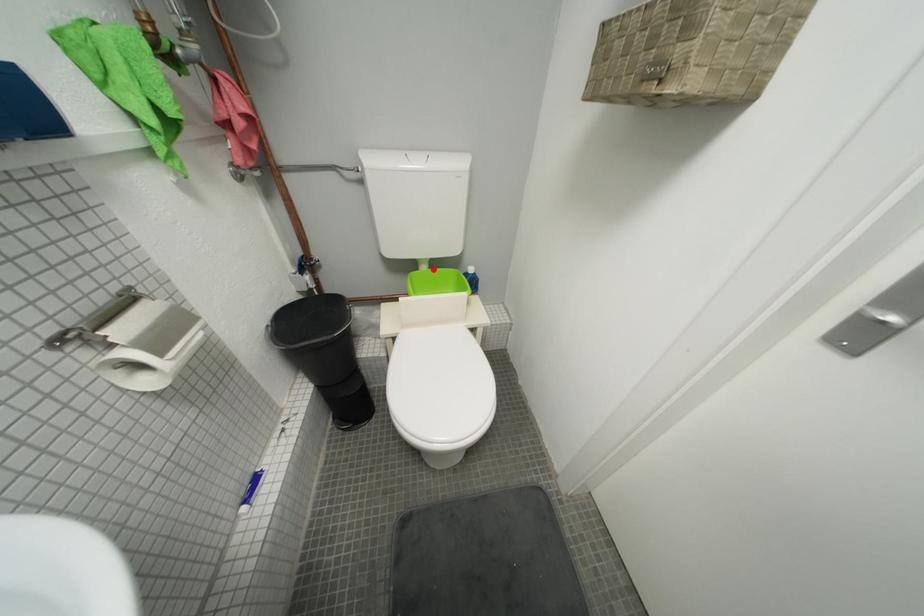
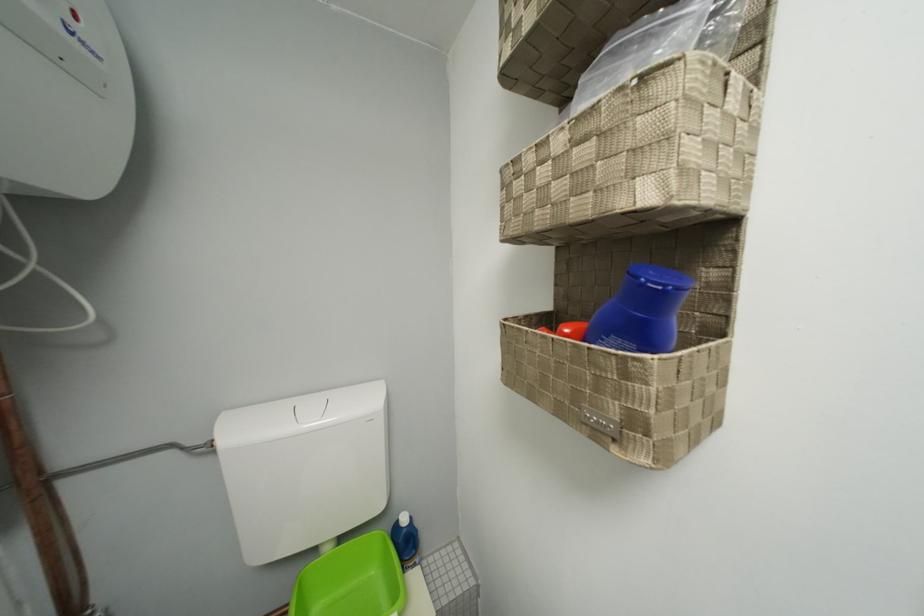
Where in the second image is the point corresponding to the highlighted location from the first image?

(335, 552)